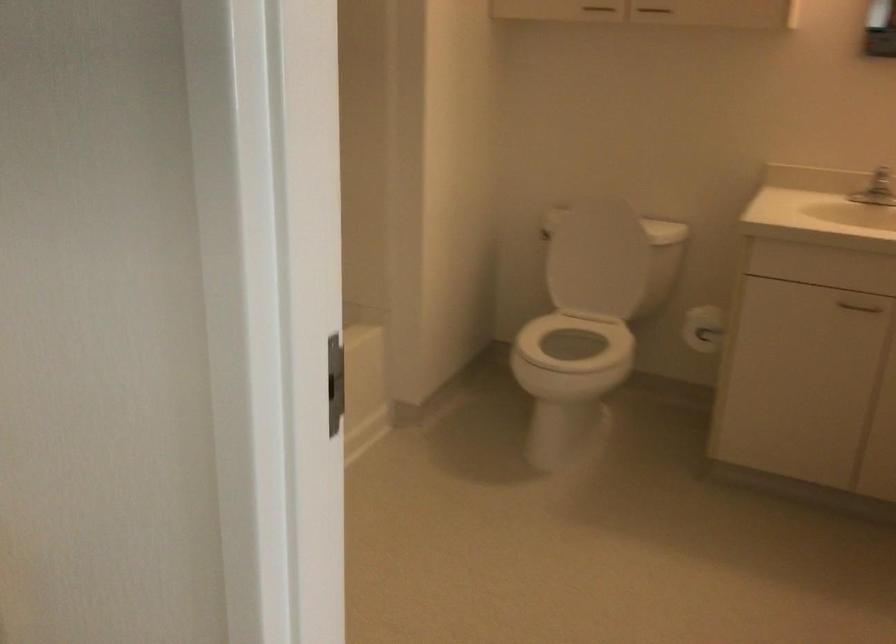
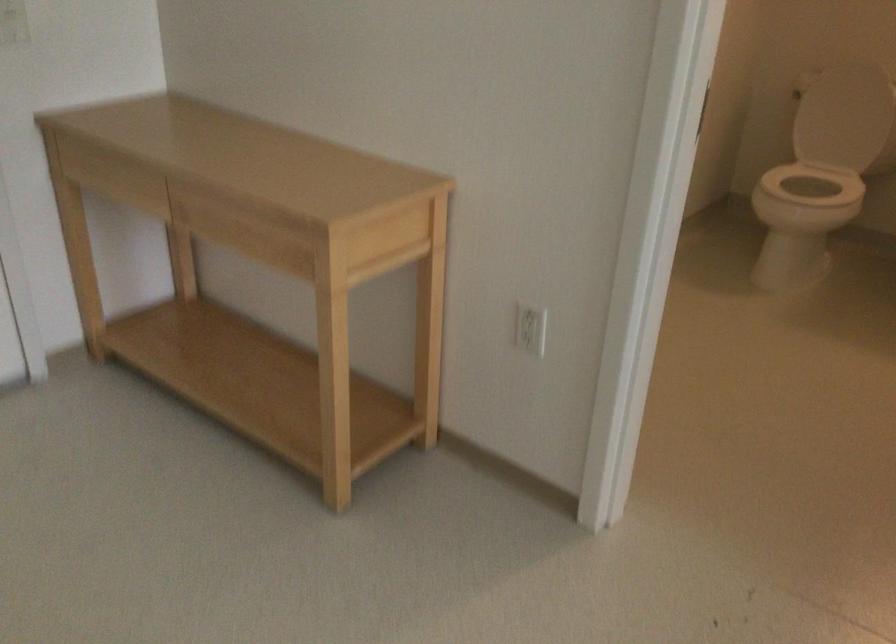
The point at (571, 278) is marked in the first image. Where is the corresponding point in the second image?

(839, 118)